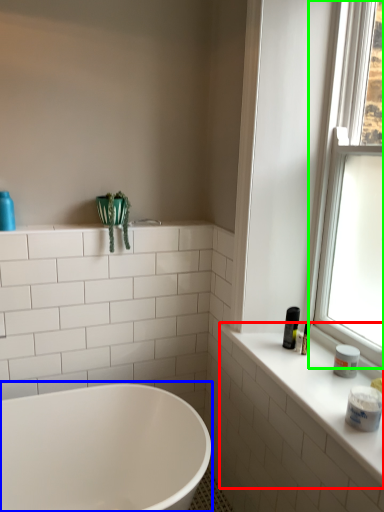
Question: Which object is the farthest from counter top (highlighted by a red box)? Choose among these: bathtub (highlighted by a blue box) or window (highlighted by a green box).

Choices:
 (A) bathtub
 (B) window

Answer: (A)